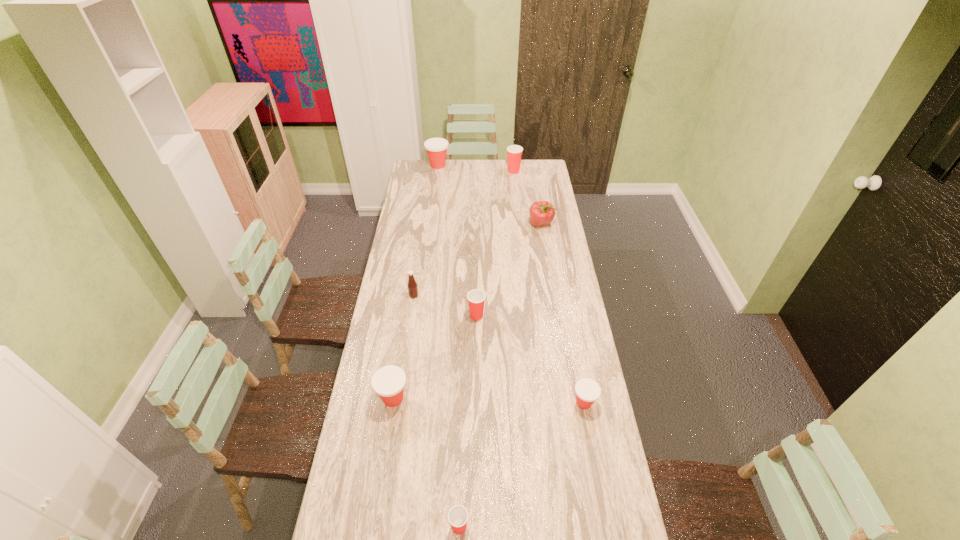
Locate an element on the screen. the smallest red-orange Dixie cup is located at coordinates (587, 391).

Identify the location of the rightmost red-orange Dixie cup. (587, 391).

At what (x,y) coordinates should I click in order to perform the action: click on the nearest red Dixie cup. Please return your answer as a coordinate pair (x, y). The image size is (960, 540). Looking at the image, I should click on (458, 515).

The image size is (960, 540). I want to click on the nearest Dixie cup, so click(x=458, y=515).

You are a GUI agent. You are given a task and a screenshot of the screen. Output one action in this format:
    pyautogui.click(x=<x>, y=<y>)
    Task: Click on the vacant space located on the front of the biggest red-orange Dixie cup
    
    Given the screenshot: What is the action you would take?
    pyautogui.click(x=432, y=210)

Where is `vacant area situated 0.120m on the left of the farthest red Dixie cup`? vacant area situated 0.120m on the left of the farthest red Dixie cup is located at coordinates (487, 171).

Where is `free space located 0.300m on the front of the Tabasco sauce`? free space located 0.300m on the front of the Tabasco sauce is located at coordinates (405, 355).

I want to click on free space located 0.130m on the left of the bell pepper, so click(x=504, y=224).

Locate an element on the screen. This screenshot has height=540, width=960. blank space located on the right of the second biggest red-orange Dixie cup is located at coordinates (445, 399).

At what (x,y) coordinates should I click in order to perform the action: click on vacant space located on the back of the fourth nearest Dixie cup. Please return your answer as a coordinate pair (x, y). The image size is (960, 540). Looking at the image, I should click on (477, 282).